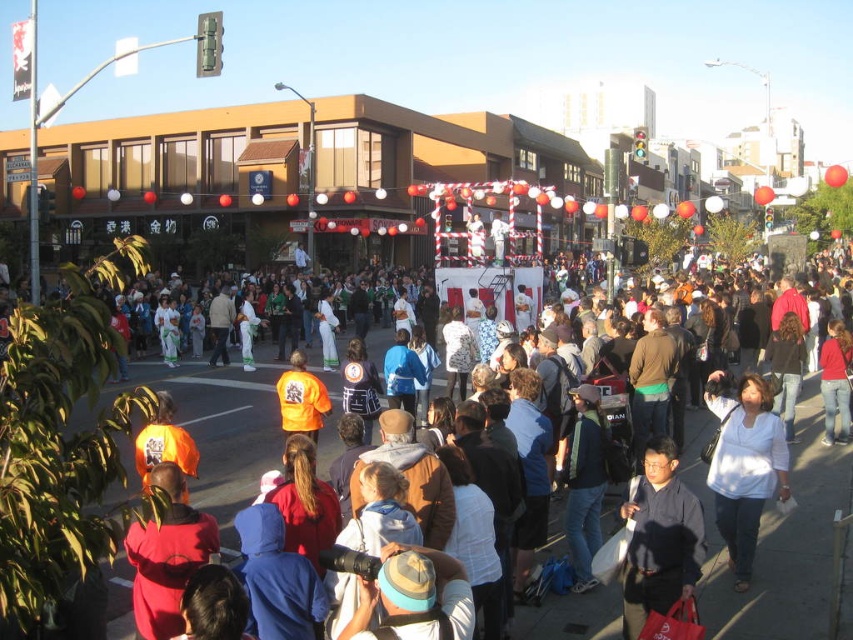
You are standing at the center of the street and want to take a photo of both the point at coordinates (759, 468) and the point at (160, 576). Which point should you focus on first to ensure both are in focus?

You should focus on the point at coordinates (759, 468) first because it is further away from you than the point at (160, 576). By focusing on the further point, the closer point will also be within the depth of field, ensuring both are in focus.

You are a photographer standing at the edge of the crowd. You want to take a photo that includes both the dark gray shirt at center and the white matte shirt at center. Given that your camera has a maximum focus range of 4 meters, will you be able to capture both subjects in focus?

The dark gray shirt at center is 4.03 meters away from the white matte shirt at center. Since the distance between them exceeds the camera maximum focus range of 4 meters, you cannot capture both subjects in focus.

You are a photographer trying to capture a photo of the white matte shirt at center and orange reflective vest at center. Which object will appear narrower in the photo?

The white matte shirt at center has a lesser width compared to the orange reflective vest at center, so it will appear narrower in the photo.